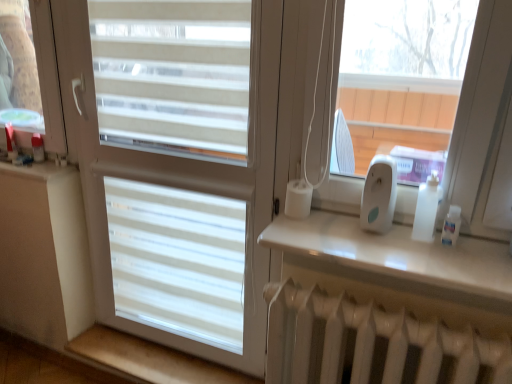
Question: In terms of size, does beige wood at lower left, the first window sill ordered from the bottom, appear bigger or smaller than white matte window at center?

Choices:
 (A) small
 (B) big

Answer: (A)

Question: Does point (108, 352) appear closer or farther from the camera than point (225, 331)?

Choices:
 (A) closer
 (B) farther

Answer: (B)

Question: Which object is positioned closest to the white matte window at center?

Choices:
 (A) white glossy shelf at upper right, placed as the second window sill when sorted from left to right
 (B) white plastic ipod at right
 (C) beige wood at lower left, the second window sill from the top

Answer: (A)

Question: Which object is the closest to the white matte window at center?

Choices:
 (A) white glossy shelf at upper right, the second window sill from the back
 (B) beige wood at lower left, the 1th window sill when ordered from left to right
 (C) white plastic ipod at right

Answer: (A)